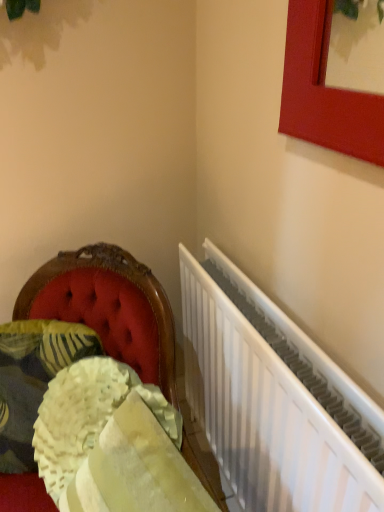
Question: Is velvet cushion at left closer to camera compared to fluffy white pillow at lower left?

Choices:
 (A) no
 (B) yes

Answer: (B)

Question: From a real-world perspective, does velvet cushion at left sit lower than fluffy white pillow at lower left?

Choices:
 (A) no
 (B) yes

Answer: (B)

Question: Does velvet cushion at left lie behind fluffy white pillow at lower left?

Choices:
 (A) no
 (B) yes

Answer: (A)

Question: Considering the relative sizes of velvet cushion at left and fluffy white pillow at lower left in the image provided, is velvet cushion at left taller than fluffy white pillow at lower left?

Choices:
 (A) yes
 (B) no

Answer: (A)

Question: From a real-world perspective, is velvet cushion at left located higher than fluffy white pillow at lower left?

Choices:
 (A) yes
 (B) no

Answer: (B)

Question: Considering the relative sizes of velvet cushion at left and fluffy white pillow at lower left in the image provided, is velvet cushion at left smaller than fluffy white pillow at lower left?

Choices:
 (A) yes
 (B) no

Answer: (B)

Question: From the image's perspective, does white metallic radiator at right appear lower than velvet cushion at left?

Choices:
 (A) yes
 (B) no

Answer: (B)

Question: Considering the relative sizes of white metallic radiator at right and velvet cushion at left in the image provided, is white metallic radiator at right smaller than velvet cushion at left?

Choices:
 (A) no
 (B) yes

Answer: (A)

Question: Can you confirm if white metallic radiator at right is shorter than velvet cushion at left?

Choices:
 (A) no
 (B) yes

Answer: (A)

Question: Considering the relative positions of white metallic radiator at right and velvet cushion at left in the image provided, is white metallic radiator at right to the right of velvet cushion at left from the viewer's perspective?

Choices:
 (A) no
 (B) yes

Answer: (B)

Question: Would you say white metallic radiator at right contains velvet cushion at left?

Choices:
 (A) yes
 (B) no

Answer: (B)

Question: Considering the relative sizes of white metallic radiator at right and velvet cushion at left in the image provided, is white metallic radiator at right thinner than velvet cushion at left?

Choices:
 (A) no
 (B) yes

Answer: (B)

Question: Does fluffy white pillow at lower left come in front of white metallic radiator at right?

Choices:
 (A) yes
 (B) no

Answer: (B)